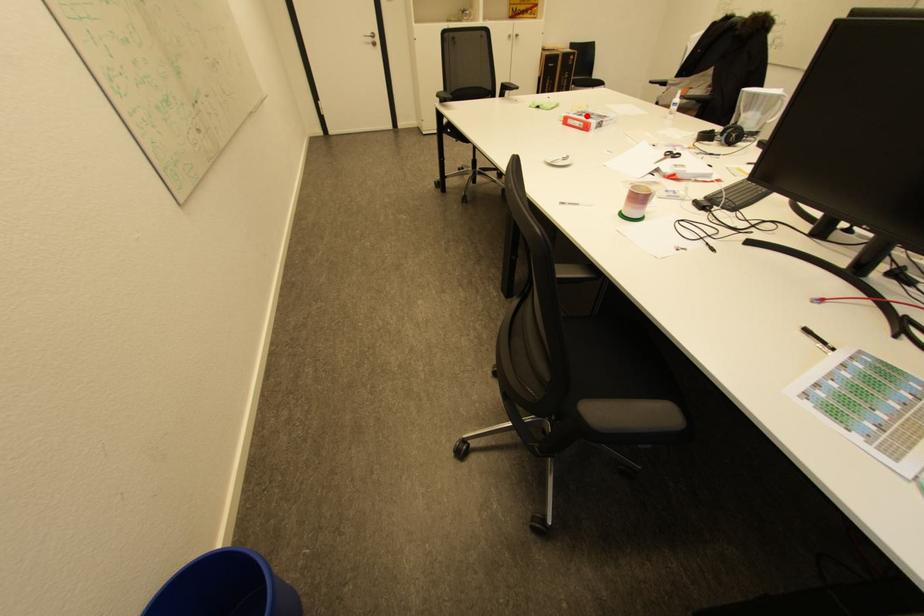
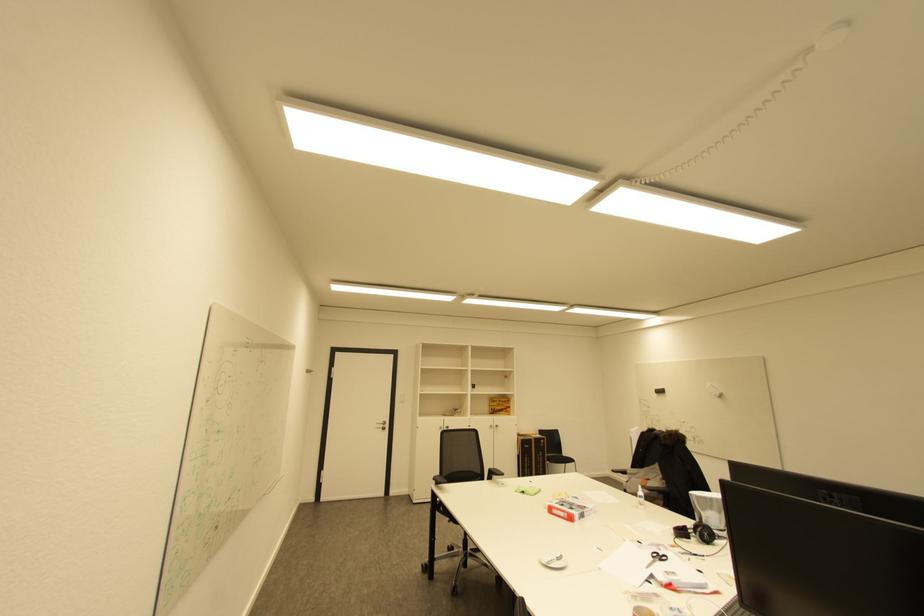
Question: I am providing you with two images of the same scene from different viewpoints. A red point is marked on the first image. Is the red point's position out of view in image 2?

Choices:
 (A) Yes
 (B) No

Answer: (B)